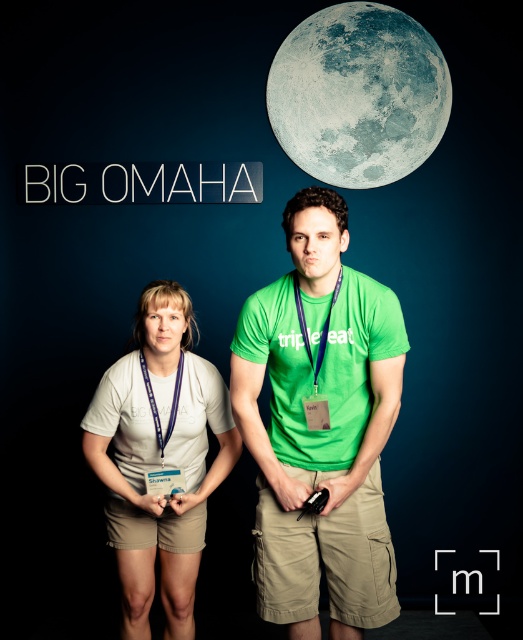
You are standing in front of the image and want to place a sticker on the point labeled as point (321, 429). Based on the scene description, where exactly should you place the sticker?

The point (321, 429) is on the green matte shirt at center, so place the sticker there.